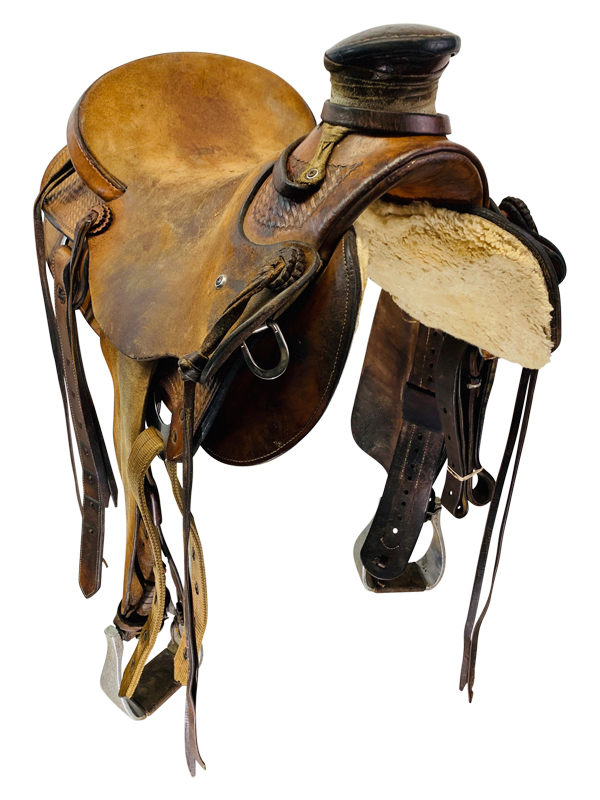
What are the coordinates of `seat` in the screenshot? It's located at (230, 138).